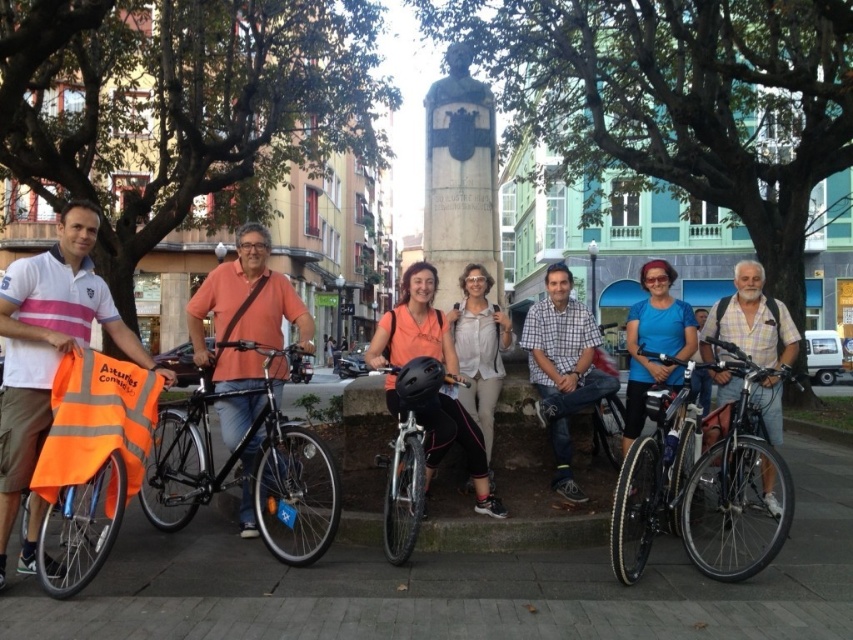
You are standing at the point with coordinates point (671, 307) and want to walk towards the statue or monument in the center of the group. Is the point point (699, 538) located between you and the statue or monument?

Point (699, 538) is in front of point (671, 307), so yes, it is between you and the statue or monument in the center of the group.

You are a photographer trying to capture a photo of the shiny silver bicycle at center and the plaid cotton shirt at center. Which object should you focus on first if you want to ensure both are in focus without adjusting the camera settings? Please explain your reasoning based on their sizes.

The shiny silver bicycle at center has a smaller size compared to the plaid cotton shirt at center. Since the plaid cotton shirt at center is larger, it would require more focus area. To ensure both are in focus, focus on the larger object first, which is the plaid cotton shirt at center, as it occupies more space in the frame.

You are a photographer trying to capture a closeup of the shiny silver bicycle at center and the plaid cotton shirt at center in the group photo. Can you fit both subjects into your camera frame if your camera has a maximum field of view that can cover 30 inches between two objects?

The shiny silver bicycle at center and plaid cotton shirt at center are 28.97 inches apart from each other, which is less than the camera frame maximum of 30 inches. Therefore, both subjects can be captured in the same frame.